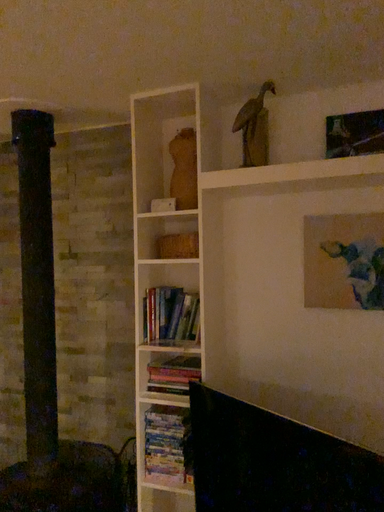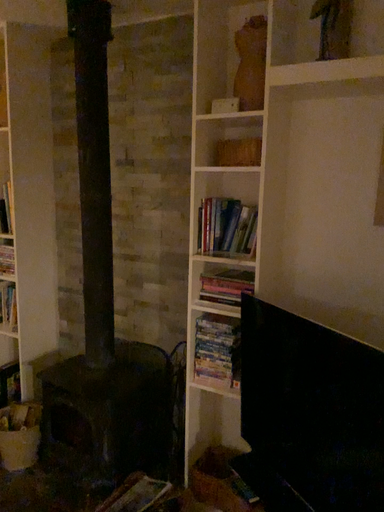
Question: Which way did the camera rotate in the video?

Choices:
 (A) rotated upward
 (B) rotated downward

Answer: (B)